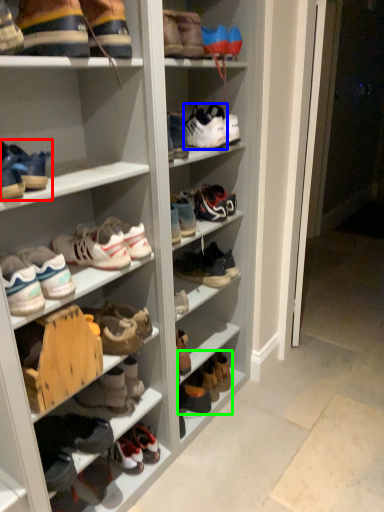
Question: Which is nearer to the footwear (highlighted by a red box)? footwear (highlighted by a blue box) or footwear (highlighted by a green box).

Choices:
 (A) footwear
 (B) footwear

Answer: (A)